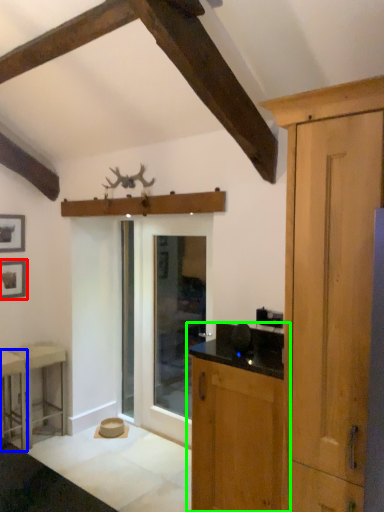
Question: Based on their relative distances, which object is farther from picture frame (highlighted by a red box)? Choose from stool (highlighted by a blue box) and cabinetry (highlighted by a green box).

Choices:
 (A) stool
 (B) cabinetry

Answer: (B)